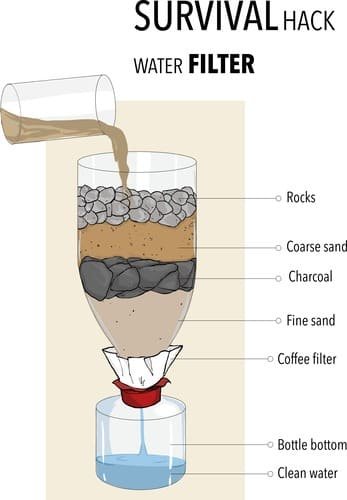
Where is `bottle`? bottle is located at coordinates (152, 425).